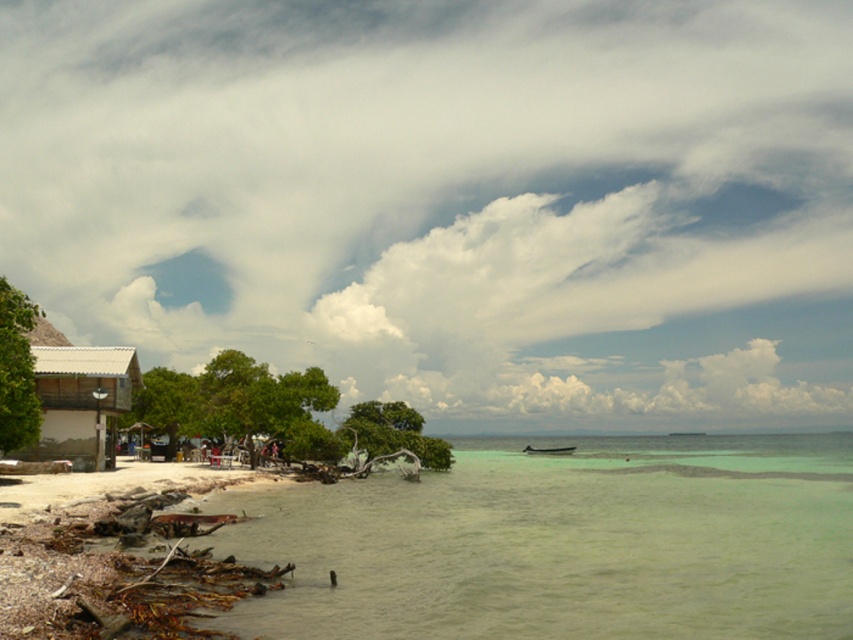
Question: Considering the real-world distances, which object is farthest from the white fluffy cloud at upper center?

Choices:
 (A) wooden hut at left
 (B) greenish water at lower left

Answer: (B)

Question: Observing the image, what is the correct spatial positioning of white fluffy cloud at upper center in reference to white plastic boat at center?

Choices:
 (A) below
 (B) above

Answer: (B)

Question: Is greenish water at lower left positioned behind white plastic boat at center?

Choices:
 (A) no
 (B) yes

Answer: (A)

Question: Which of the following is the farthest from the observer?

Choices:
 (A) white plastic boat at center
 (B) wooden hut at left

Answer: (A)

Question: Does greenish water at lower left have a lesser width compared to white plastic boat at center?

Choices:
 (A) yes
 (B) no

Answer: (B)

Question: Estimate the real-world distances between objects in this image. Which object is closer to the white plastic boat at center?

Choices:
 (A) greenish water at lower left
 (B) white fluffy cloud at upper center
 (C) wooden hut at left

Answer: (A)